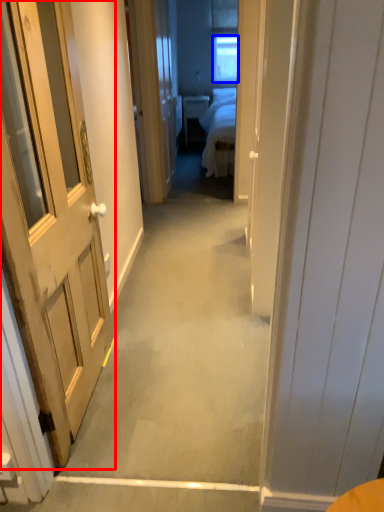
Question: Which of the following is the farthest to the observer, door (highlighted by a red box) or window (highlighted by a blue box)?

Choices:
 (A) door
 (B) window

Answer: (B)